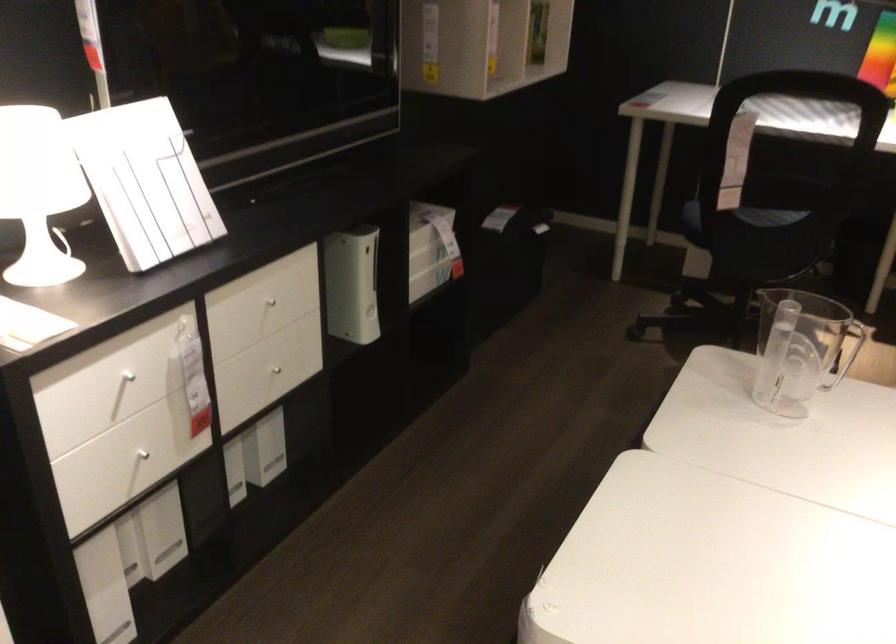
Where is `black fabric bin`? black fabric bin is located at coordinates (507, 263).